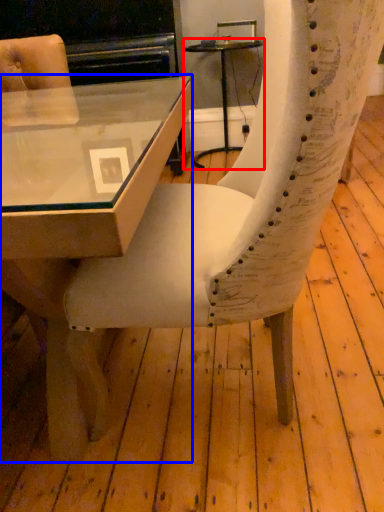
Question: Which object appears farthest to the camera in this image, table (highlighted by a red box) or table (highlighted by a blue box)?

Choices:
 (A) table
 (B) table

Answer: (A)